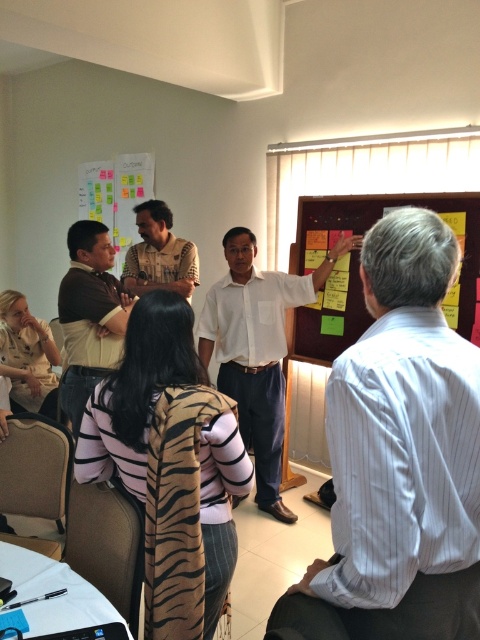
You are organizing a meeting in this room and need to ensure that all participants can see both the white striped shirt at center and the wooden bulletin board at center clearly. Which object should be placed closer to the front of the room to ensure visibility?

The white striped shirt at center is smaller than the wooden bulletin board at center, so to ensure visibility for all participants, the white striped shirt at center should be placed closer to the front of the room. Smaller objects typically require closer proximity to be seen clearly by everyone in the room.

You are a photographer trying to capture a photo of the white striped shirt at center and the wooden bulletin board at center. Which object should you focus on first if you want to ensure both are in the frame without moving the camera?

The white striped shirt at center is not as tall as the wooden bulletin board at center, so you should focus on the wooden bulletin board at center first to ensure both are in the frame.

You are organizing a photo shoot and need to place two shirts in the scene. The white striped shirt at center and the white shirt at center must be positioned such that the smaller one is placed in front of the larger one. Is this arrangement possible based on their sizes?

The white striped shirt at center is smaller than the white shirt at center, so yes, the smaller white striped shirt at center can be placed in front of the larger white shirt at center to ensure visibility.